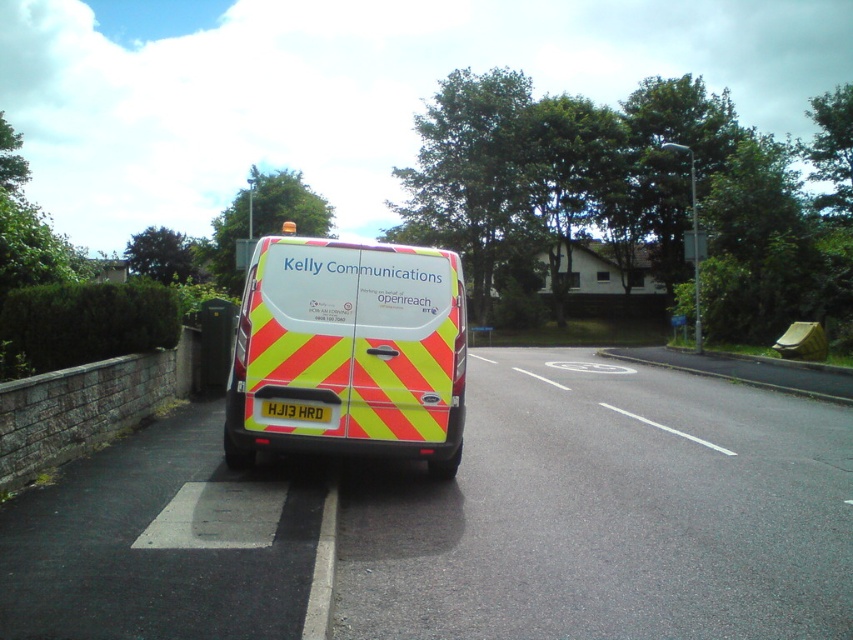
Question: Among these objects, which one is farthest from the camera?

Choices:
 (A) reflective yellow and red van at center
 (B) white plastic license plate at rear

Answer: (B)

Question: Is reflective yellow and red van at center further to the viewer compared to white plastic license plate at rear?

Choices:
 (A) yes
 (B) no

Answer: (B)

Question: Among these objects, which one is farthest from the camera?

Choices:
 (A) white plastic license plate at rear
 (B) reflective yellow and red van at center

Answer: (A)

Question: Is reflective yellow and red van at center positioned in front of white plastic license plate at rear?

Choices:
 (A) yes
 (B) no

Answer: (A)

Question: Does reflective yellow and red van at center have a smaller size compared to white plastic license plate at rear?

Choices:
 (A) yes
 (B) no

Answer: (B)